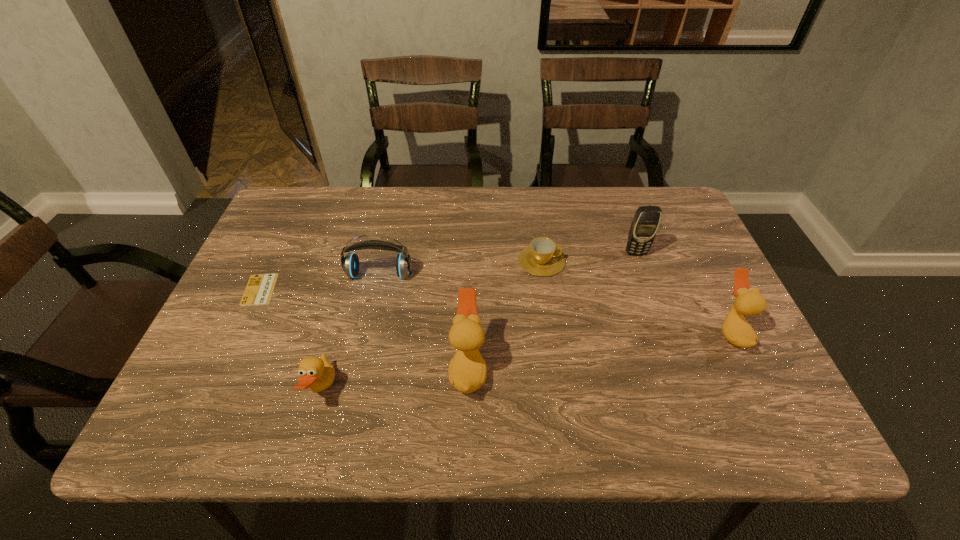
Where is `vacant space located on the front face of the cellular telephone`? This screenshot has width=960, height=540. vacant space located on the front face of the cellular telephone is located at coordinates (670, 349).

This screenshot has height=540, width=960. Identify the location of vacant space located 0.160m on the ear cups of the headset. (367, 334).

What are the coordinates of `vacant space situated with the handle on the side of the sixth tallest object` in the screenshot? It's located at (661, 261).

Locate an element on the screen. The width and height of the screenshot is (960, 540). object present at the left edge is located at coordinates (259, 290).

The width and height of the screenshot is (960, 540). In order to click on duck located in the right edge section of the desktop in this screenshot , I will do `click(749, 302)`.

The width and height of the screenshot is (960, 540). In order to click on cellular telephone that is at the right edge in this screenshot , I will do `click(644, 226)`.

In the image, there is a desktop. Identify the location of free space at the far edge. This screenshot has height=540, width=960. (606, 212).

Identify the location of free location at the near edge of the desktop. (630, 365).

In the image, there is a desktop. What are the coordinates of `free space at the left edge` in the screenshot? It's located at (276, 248).

The width and height of the screenshot is (960, 540). In order to click on vacant space at the near right corner of the desktop in this screenshot , I will do `click(736, 378)`.